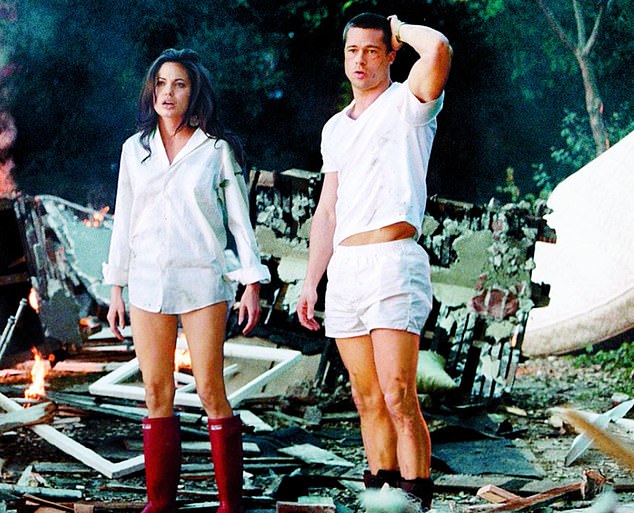
At what (x,y) coordinates should I click in order to perform the action: click on broken window frame. Please return your answer as a coordinate pair (x, y). Image resolution: width=634 pixels, height=513 pixels. Looking at the image, I should click on (245, 383).